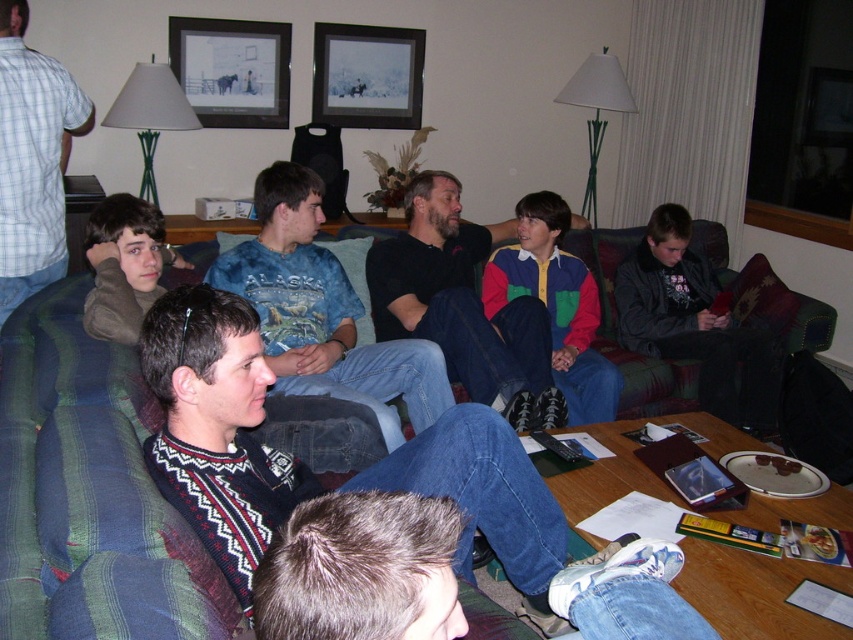
Between green striped fabric couch at center and blue plaid shirt at left, which one is positioned lower?

green striped fabric couch at center is below.

Does green striped fabric couch at center appear under blue plaid shirt at left?

Yes.

What are the coordinates of `green striped fabric couch at center` in the screenshot? It's located at (88, 493).

Can you confirm if black cotton shirt at center is positioned to the right of metallic silver picture frame at upper center?

Indeed, black cotton shirt at center is positioned on the right side of metallic silver picture frame at upper center.

Between point (521, 369) and point (265, 52), which one is positioned in front?

Point (521, 369) is in front.

Where is `black cotton shirt at center`? black cotton shirt at center is located at coordinates (462, 305).

Is point (474, 390) closer to camera compared to point (71, 106)?

That is True.

Can you confirm if black cotton shirt at center is positioned below blue plaid shirt at left?

Correct, black cotton shirt at center is located below blue plaid shirt at left.

Identify the location of black cotton shirt at center. (462, 305).

Where is `black cotton shirt at center`? Image resolution: width=853 pixels, height=640 pixels. black cotton shirt at center is located at coordinates (462, 305).